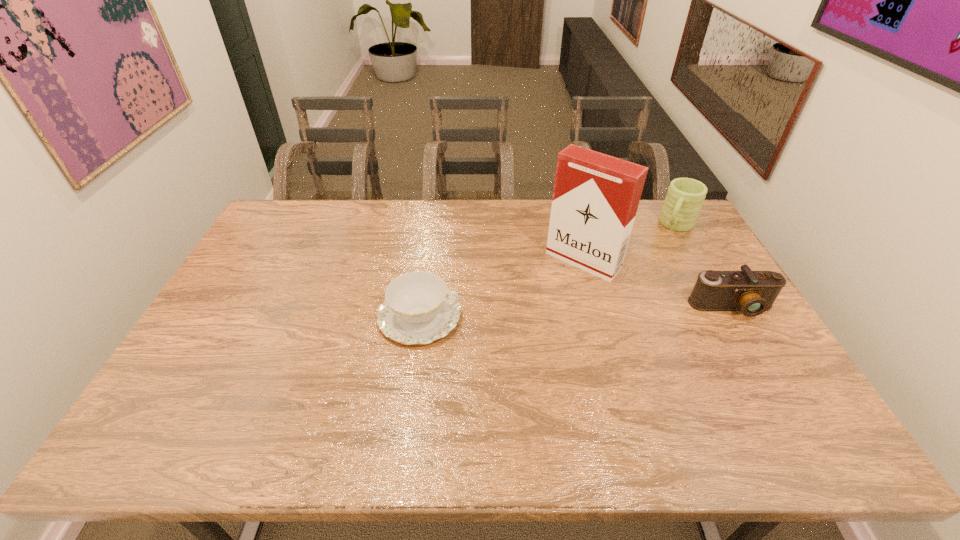
Find the location of a particular element. Image resolution: width=960 pixels, height=540 pixels. vacant space on the desktop that is between the shortest object and the third tallest object and is positioned on the side of the mug with the handle is located at coordinates (623, 310).

The width and height of the screenshot is (960, 540). Find the location of `vacant spot on the desktop that is between the shortest object and the camera and is positioned on the front-facing side of the cigarette_case`. vacant spot on the desktop that is between the shortest object and the camera and is positioned on the front-facing side of the cigarette_case is located at coordinates (534, 313).